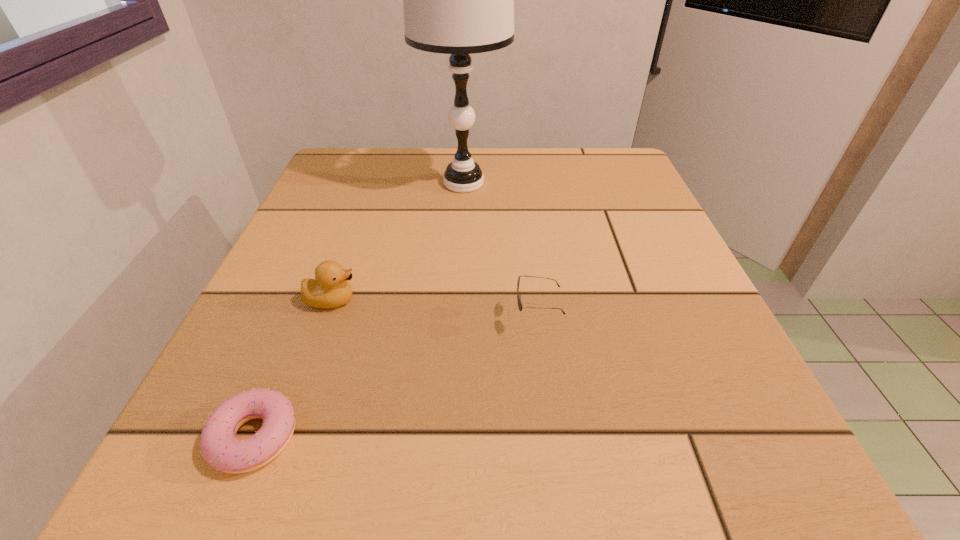
At what (x,y) coordinates should I click in order to perform the action: click on vacant space at the right edge of the desktop. Please return your answer as a coordinate pair (x, y). The height and width of the screenshot is (540, 960). Looking at the image, I should click on (700, 293).

Image resolution: width=960 pixels, height=540 pixels. In the image, there is a desktop. Find the location of `vacant space at the far left corner`. vacant space at the far left corner is located at coordinates (355, 153).

What are the coordinates of `vacant space at the near left corner` in the screenshot? It's located at (245, 427).

You are a GUI agent. You are given a task and a screenshot of the screen. Output one action in this format:
    pyautogui.click(x=<x>, y=<y>)
    Task: Click on the free space at the far right corner of the desktop
    
    Given the screenshot: What is the action you would take?
    pyautogui.click(x=648, y=194)

The width and height of the screenshot is (960, 540). I want to click on vacant area between the sunglasses and the doughnut, so pyautogui.click(x=396, y=378).

Image resolution: width=960 pixels, height=540 pixels. Find the location of `free spot between the doughnut and the sunglasses`. free spot between the doughnut and the sunglasses is located at coordinates (396, 378).

Where is `vacant area between the duckling and the sunglasses`? vacant area between the duckling and the sunglasses is located at coordinates (434, 309).

I want to click on free space between the tallest object and the nearest object, so click(x=359, y=310).

The image size is (960, 540). Identify the location of empty space that is in between the sunglasses and the duckling. [434, 309].

The height and width of the screenshot is (540, 960). I want to click on vacant area that lies between the sunglasses and the doughnut, so click(x=396, y=378).